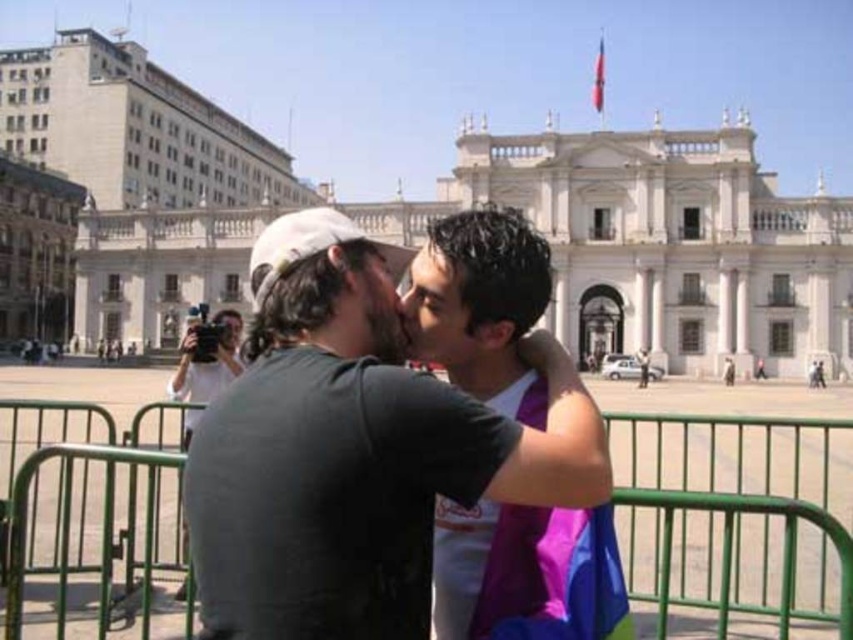
Can you confirm if white stone building at center is positioned to the right of green metal fence at center?

No, white stone building at center is not to the right of green metal fence at center.

Identify the location of white stone building at center. This screenshot has width=853, height=640. (662, 241).

At what (x,y) coordinates should I click in order to perform the action: click on white stone building at center. Please return your answer as a coordinate pair (x, y). Looking at the image, I should click on (662, 241).

Locate an element on the screen. white stone building at center is located at coordinates (662, 241).

Which is behind, point (766, 534) or point (497, 560)?

The point (766, 534) is more distant.

Who is more forward, (699, 554) or (518, 596)?

Point (518, 596) is more forward.

Find the location of a particular element. This screenshot has width=853, height=640. green metal fence at center is located at coordinates point(734,513).

Is white stone building at center thinner than purple fabric at center?

No, white stone building at center is not thinner than purple fabric at center.

Is the position of white stone building at center less distant than that of purple fabric at center?

No, white stone building at center is behind purple fabric at center.

Is point (682, 371) farther from viewer compared to point (428, 296)?

Yes, point (682, 371) is farther from viewer.

The image size is (853, 640). In order to click on white stone building at center in this screenshot , I will do `click(662, 241)`.